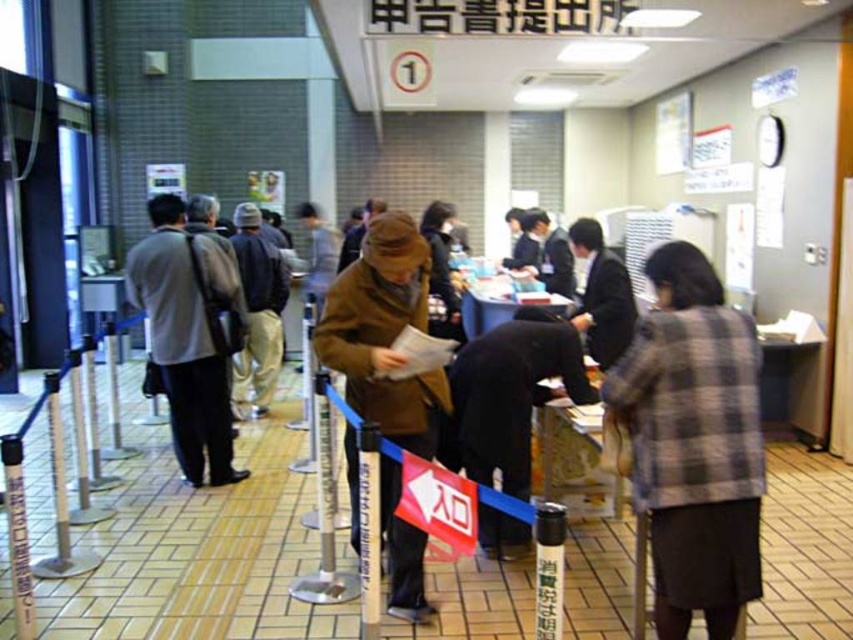
Which is behind, point (727, 586) or point (410, 417)?

Positioned behind is point (410, 417).

Can you confirm if plaid fabric jacket at center is positioned to the left of brown woolen coat at center?

In fact, plaid fabric jacket at center is to the right of brown woolen coat at center.

Is point (666, 504) farther from camera compared to point (421, 276)?

No.

Identify the location of plaid fabric jacket at center. This screenshot has width=853, height=640. pyautogui.click(x=693, y=442).